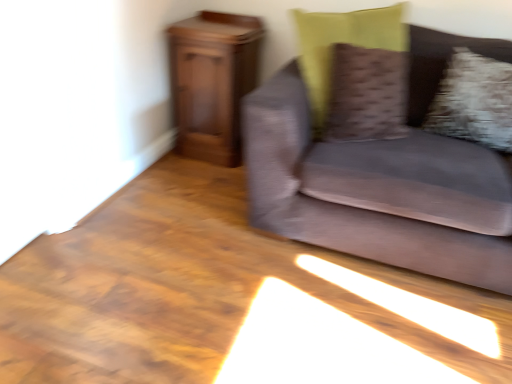
Question: Is wooden cabinet at left surrounding fluffy white pillow at right, arranged as the 2th pillow when viewed from the left?

Choices:
 (A) no
 (B) yes

Answer: (A)

Question: Is wooden cabinet at left directly adjacent to fluffy white pillow at right, arranged as the 2th pillow when viewed from the left?

Choices:
 (A) yes
 (B) no

Answer: (B)

Question: Is wooden cabinet at left positioned with its back to fluffy white pillow at right, arranged as the 2th pillow when viewed from the left?

Choices:
 (A) no
 (B) yes

Answer: (A)

Question: Does wooden cabinet at left have a lesser width compared to fluffy white pillow at right, arranged as the 2th pillow when viewed from the left?

Choices:
 (A) yes
 (B) no

Answer: (B)

Question: Is wooden cabinet at left wider than fluffy white pillow at right, the 1th pillow viewed from the right?

Choices:
 (A) no
 (B) yes

Answer: (B)

Question: Would you say textured brown pillow at upper right, which appears as the first pillow when viewed from the left, is to the left or to the right of wooden cabinet at left in the picture?

Choices:
 (A) right
 (B) left

Answer: (A)

Question: Does point (312, 13) appear closer or farther from the camera than point (194, 129)?

Choices:
 (A) farther
 (B) closer

Answer: (B)

Question: Is textured brown pillow at upper right, the 2th pillow when ordered from right to left, inside the boundaries of wooden cabinet at left, or outside?

Choices:
 (A) inside
 (B) outside

Answer: (B)

Question: Is textured brown pillow at upper right, the 2th pillow when ordered from right to left, bigger or smaller than wooden cabinet at left?

Choices:
 (A) small
 (B) big

Answer: (A)

Question: From a real-world perspective, is fluffy white pillow at right, the 1th pillow viewed from the right, positioned above or below wooden cabinet at left?

Choices:
 (A) below
 (B) above

Answer: (B)

Question: Would you say fluffy white pillow at right, the 1th pillow viewed from the right, is to the left or to the right of wooden cabinet at left in the picture?

Choices:
 (A) right
 (B) left

Answer: (A)

Question: From their relative heights in the image, would you say fluffy white pillow at right, arranged as the 2th pillow when viewed from the left, is taller or shorter than wooden cabinet at left?

Choices:
 (A) short
 (B) tall

Answer: (A)

Question: In the image, is fluffy white pillow at right, arranged as the 2th pillow when viewed from the left, positioned in front of or behind wooden cabinet at left?

Choices:
 (A) behind
 (B) front

Answer: (B)

Question: Relative to velvet gray couch at right, is wooden cabinet at left in front or behind?

Choices:
 (A) front
 (B) behind

Answer: (B)

Question: Considering the positions of wooden cabinet at left and velvet gray couch at right in the image, is wooden cabinet at left taller or shorter than velvet gray couch at right?

Choices:
 (A) tall
 (B) short

Answer: (B)